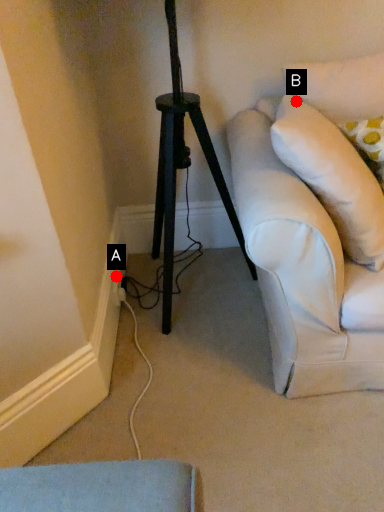
Question: Two points are circled on the image, labeled by A and B beside each circle. Which point is closer to the camera?

Choices:
 (A) A is closer
 (B) B is closer

Answer: (B)